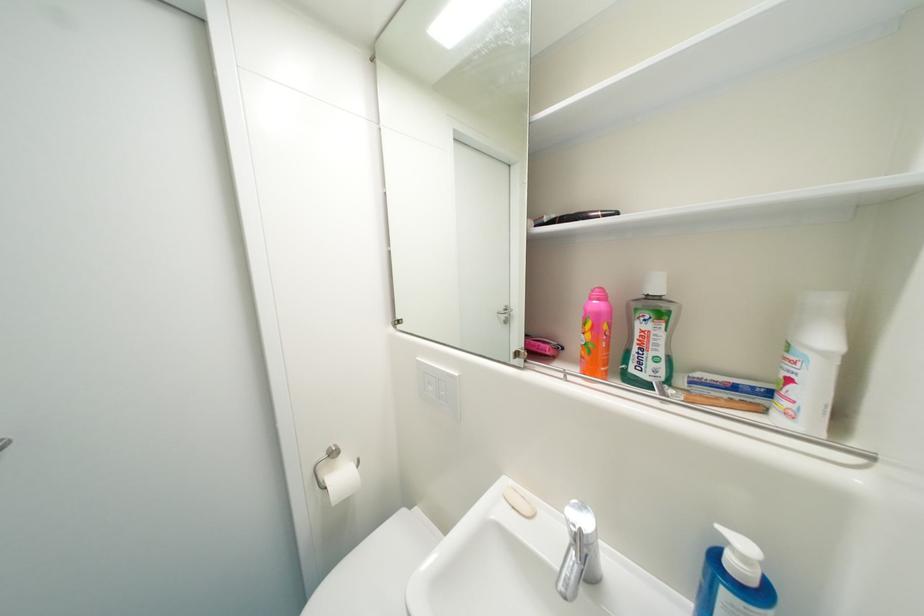
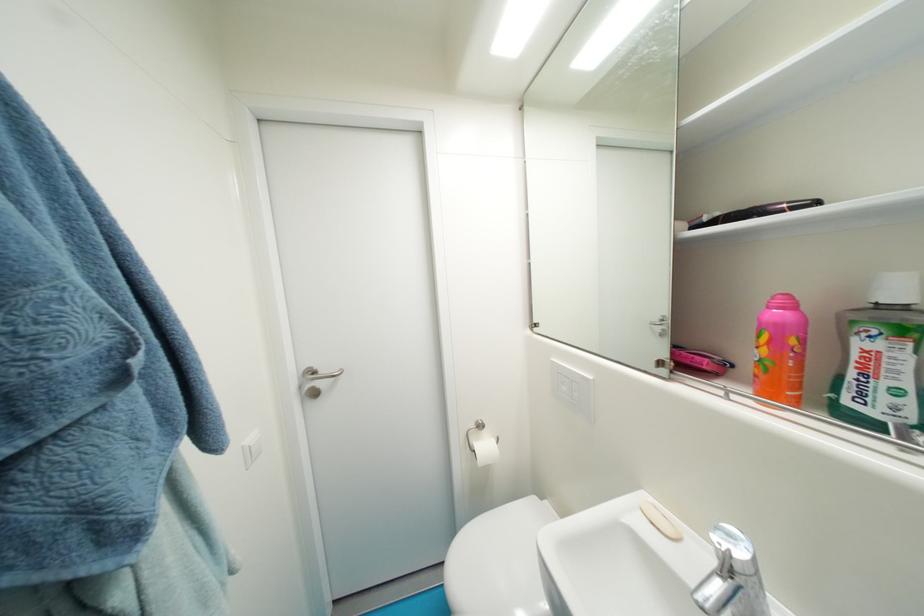
Find the pixel in the second image that matches the point at 598,347 in the first image.

(774, 363)